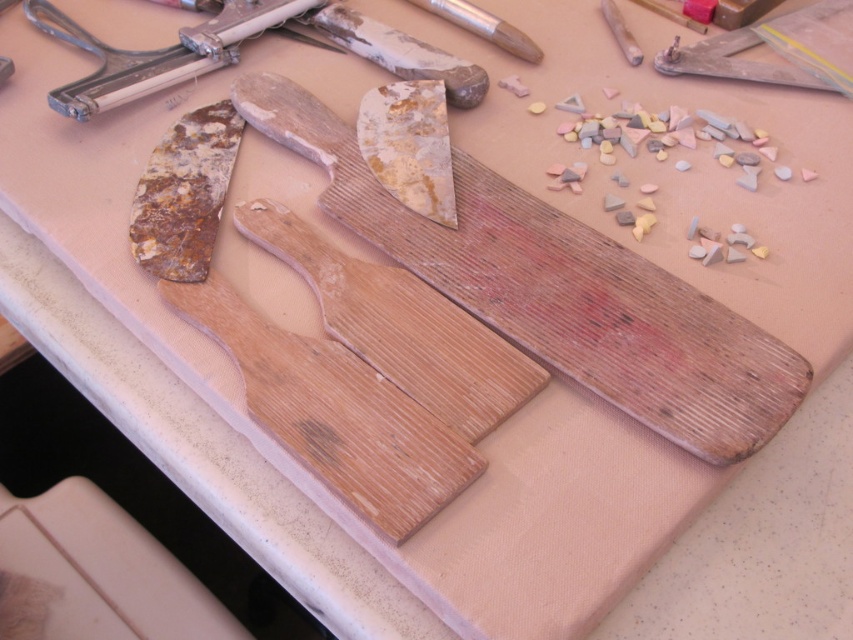
Is point (352, 136) in front of point (289, 236)?

That is False.

What do you see at coordinates (556, 289) in the screenshot?
I see `wooden cutting board at center` at bounding box center [556, 289].

Is point (601, 387) in front of point (508, 387)?

Yes, it is.

The width and height of the screenshot is (853, 640). I want to click on wooden cutting board at center, so (x=556, y=289).

Is wooden plank at center taller than metallic silver tool at upper left?

Indeed, wooden plank at center has a greater height compared to metallic silver tool at upper left.

Between point (531, 394) and point (180, 68), which one is positioned behind?

The point (180, 68) is behind.

Locate an element on the screen. This screenshot has width=853, height=640. wooden plank at center is located at coordinates (401, 326).

Where is `wooden plank at center`? wooden plank at center is located at coordinates 401,326.

Which of these two, wooden cutting board at center or metallic silver tool at upper left, stands taller?

wooden cutting board at center is taller.

Can you confirm if wooden cutting board at center is thinner than metallic silver tool at upper left?

No, wooden cutting board at center is not thinner than metallic silver tool at upper left.

Who is more forward, (672, 285) or (67, 22)?

Point (672, 285) is more forward.

At what (x,y) coordinates should I click in order to perform the action: click on wooden cutting board at center. Please return your answer as a coordinate pair (x, y). The height and width of the screenshot is (640, 853). Looking at the image, I should click on (556, 289).